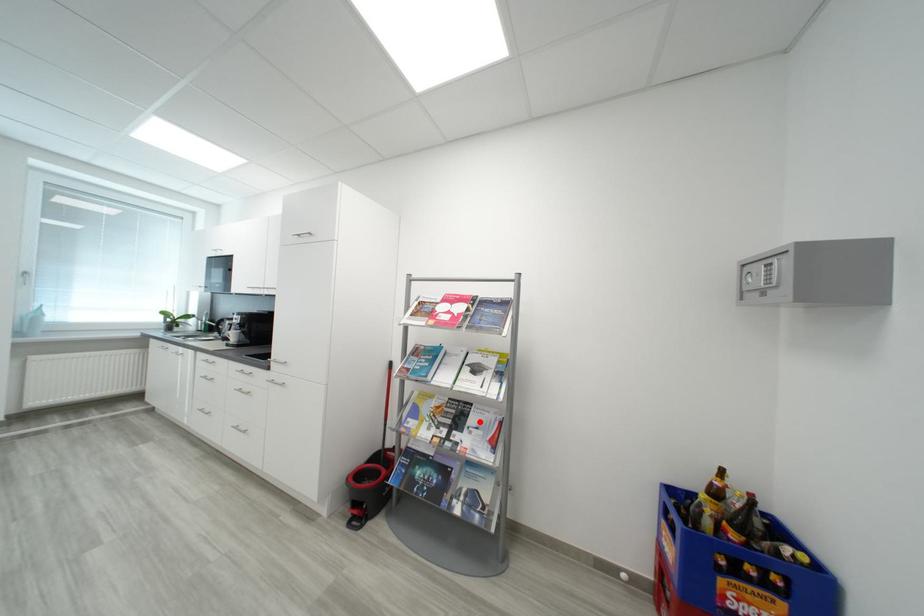
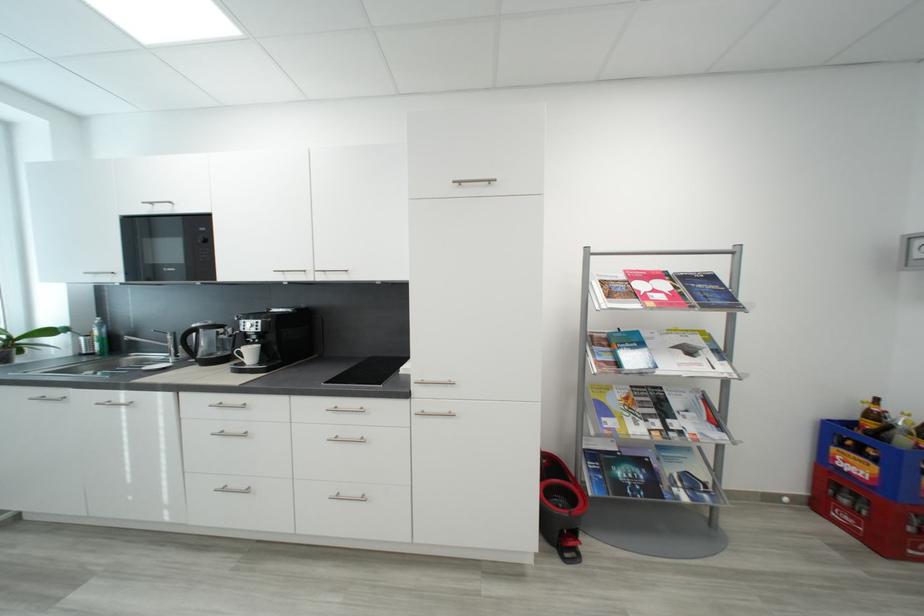
The point at the highlighted location is marked in the first image. Where is the corresponding point in the second image?

(684, 406)